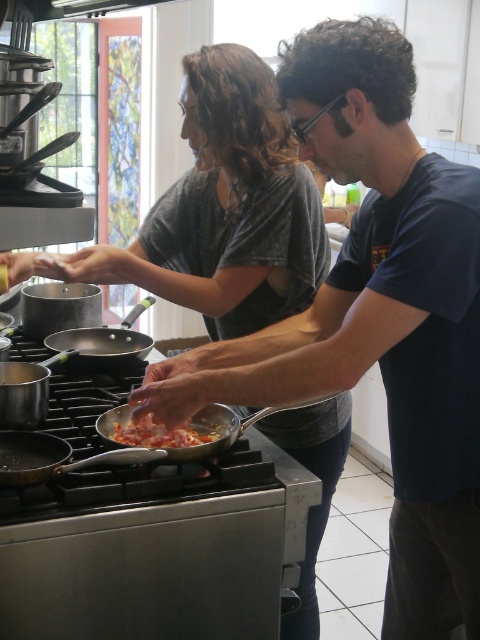
You are a chef preparing a meal and need to choose between the gold metallic frying pan at lower left and the shiny metallic pan at center. Which pan should you select if you need more cooking space?

The gold metallic frying pan at lower left is bigger than the shiny metallic pan at center, so you should choose the gold metallic frying pan at lower left for more cooking space.

You are a chef trying to choose between the metallic silver wok at center and the anodized aluminum wok at center for a recipe that requires deep frying. Which wok would be more suitable based on their sizes?

The anodized aluminum wok at center is taller than the metallic silver wok at center, making it more suitable for deep frying as it can accommodate more oil and ingredients without spilling.

You are a chef standing in the kitchen and want to reach the metallic silver wok at center. Your arm can extend 0.9 meters. Can you reach it?

The metallic silver wok at center and camera are 1.15 meters apart from each other. Since your arm can only extend 0.9 meters, you cannot reach the metallic silver wok at center.